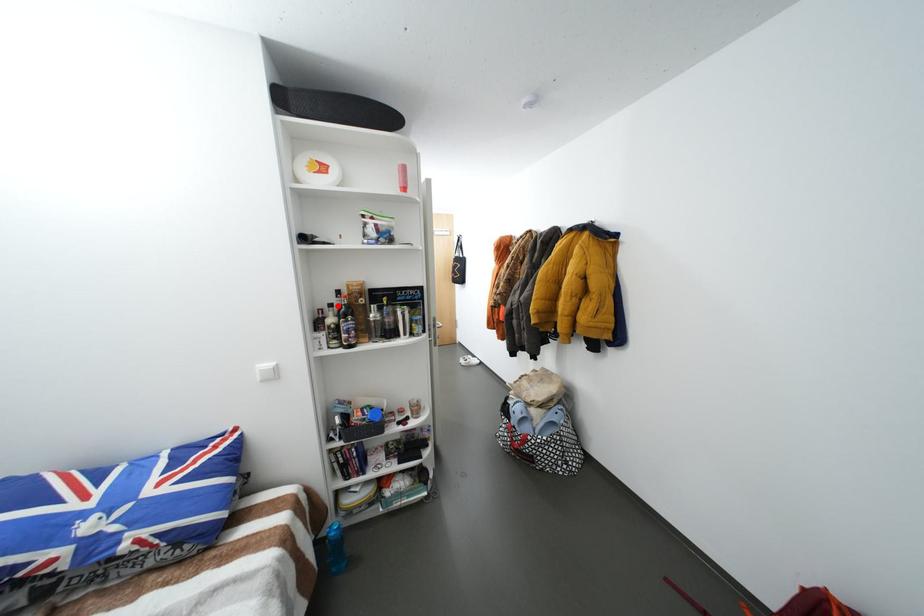
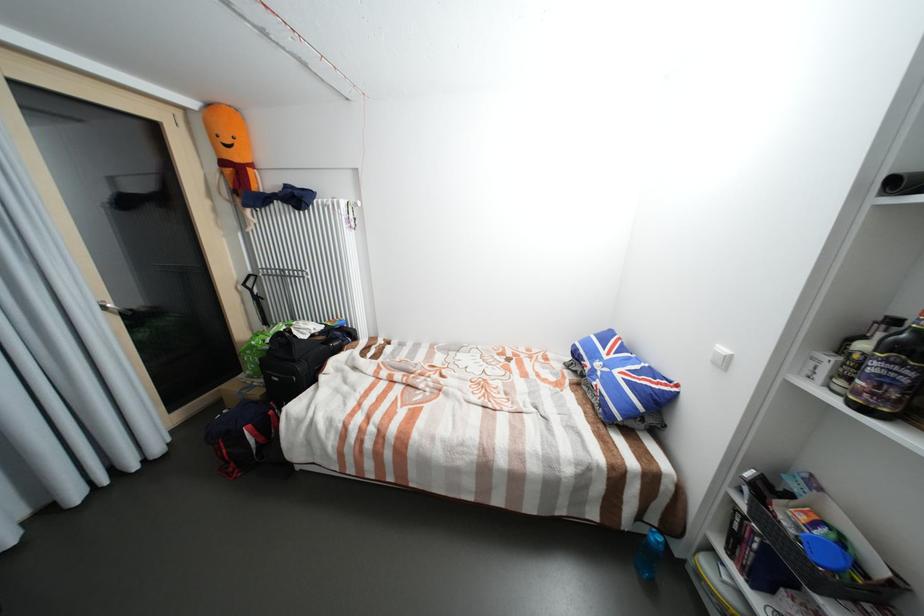
In the second image, find the point that corresponds to the highlighted location in the first image.

(901, 322)